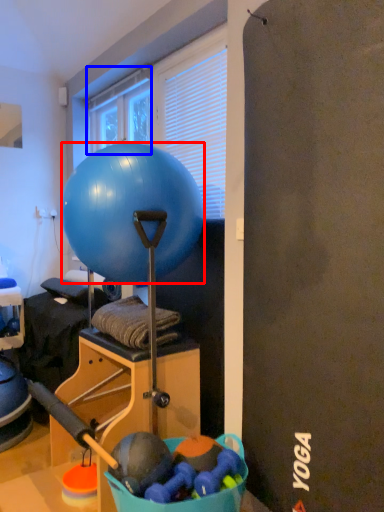
Question: Which point is closer to the camera, ball (highlighted by a red box) or window (highlighted by a blue box)?

Choices:
 (A) ball
 (B) window

Answer: (A)